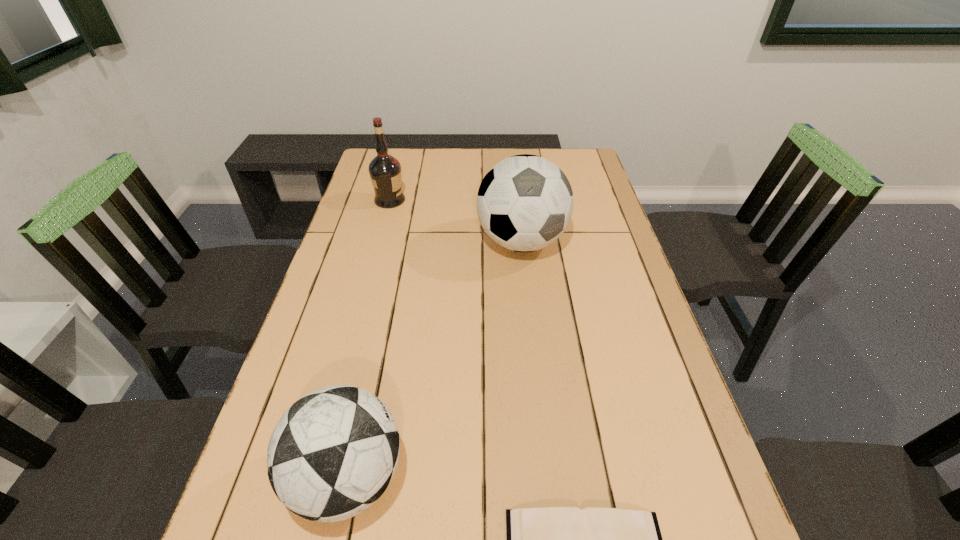
Identify the location of liquor. This screenshot has width=960, height=540. (385, 170).

At what (x,y) coordinates should I click in order to perform the action: click on the taller soccer ball. Please return your answer as a coordinate pair (x, y). The image size is (960, 540). Looking at the image, I should click on (524, 203).

You are a GUI agent. You are given a task and a screenshot of the screen. Output one action in this format:
    pyautogui.click(x=<x>, y=<y>)
    Task: Click on the right soccer ball
    Image resolution: width=960 pixels, height=540 pixels.
    Given the screenshot: What is the action you would take?
    pyautogui.click(x=524, y=203)

The width and height of the screenshot is (960, 540). What are the coordinates of `vacant region located 0.210m on the surface of the farthest object` in the screenshot? It's located at (467, 200).

I want to click on free spot located on the main logo of the right soccer ball, so click(526, 287).

The width and height of the screenshot is (960, 540). I want to click on object that is at the left edge, so click(x=385, y=170).

In the image, there is a desktop. Identify the location of free space at the far edge. (423, 176).

Where is `blank space at the left edge of the desktop`? This screenshot has width=960, height=540. blank space at the left edge of the desktop is located at coordinates (281, 511).

Locate an element on the screen. The image size is (960, 540). vacant space at the right edge is located at coordinates (643, 430).

The image size is (960, 540). Identify the location of free space at the far left corner. (372, 151).